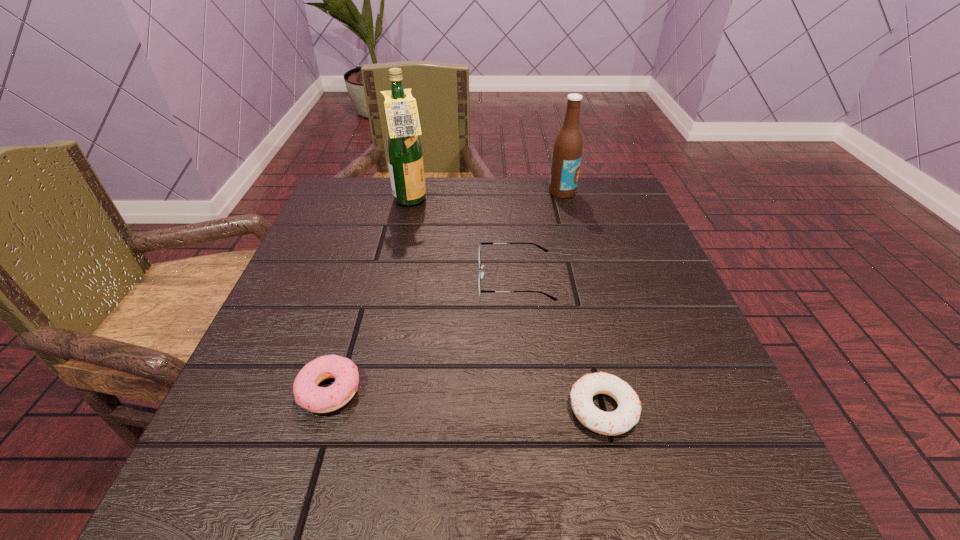
At what (x,y) coordinates should I click in order to perform the action: click on liquor. Please return your answer as a coordinate pair (x, y). Image resolution: width=960 pixels, height=540 pixels. Looking at the image, I should click on (404, 150).

Locate an element on the screen. The image size is (960, 540). the second tallest object is located at coordinates (567, 152).

At what (x,y) coordinates should I click in order to perform the action: click on the third tallest object. Please return your answer as a coordinate pair (x, y). Looking at the image, I should click on (480, 274).

Where is `spectacles`? This screenshot has width=960, height=540. spectacles is located at coordinates (480, 274).

The width and height of the screenshot is (960, 540). What are the coordinates of `the left doughnut` in the screenshot? It's located at (307, 393).

Locate an element on the screen. the right doughnut is located at coordinates (627, 414).

Identify the location of free space located on the front-facing side of the tallest object. (479, 201).

Identify the location of blank area located on the left of the fourth shortest object. The height and width of the screenshot is (540, 960). (428, 192).

Find the location of a particular element. This screenshot has height=540, width=960. free region located 0.090m on the lenses of the third shortest object is located at coordinates (432, 279).

This screenshot has height=540, width=960. In order to click on vacant space situated 0.160m on the lenses of the third shortest object in this screenshot , I will do `click(396, 279)`.